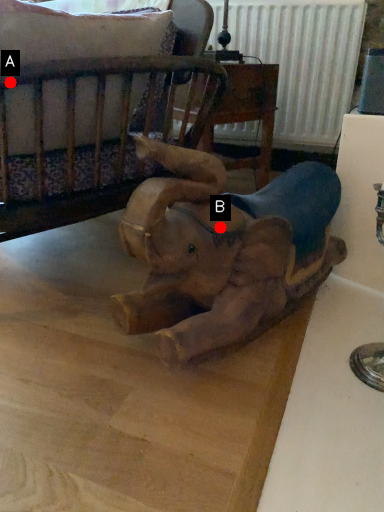
Question: Two points are circled on the image, labeled by A and B beside each circle. Which point is closer to the camera taking this photo?

Choices:
 (A) A is closer
 (B) B is closer

Answer: (A)